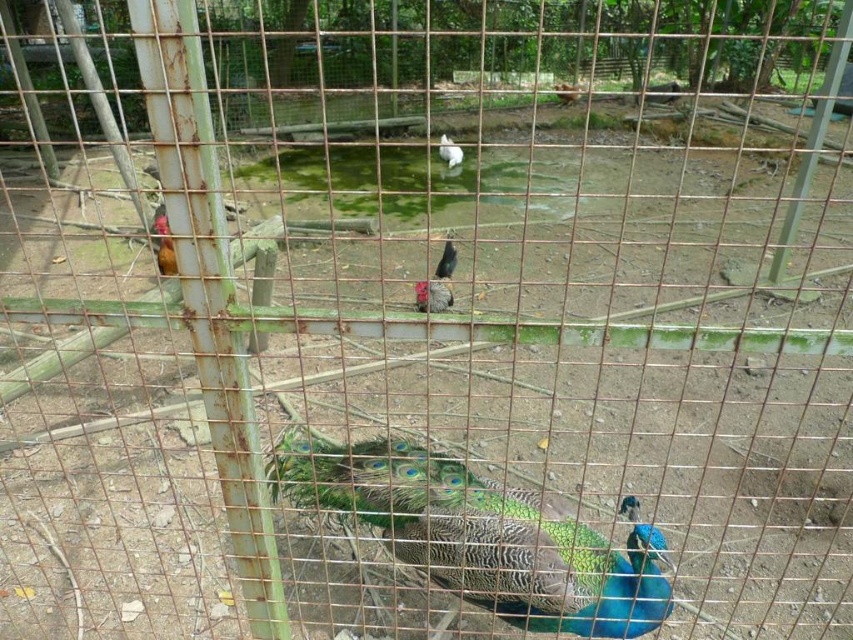
Does shiny blue peacock at center appear on the left side of shiny black rooster at center?

Indeed, shiny blue peacock at center is positioned on the left side of shiny black rooster at center.

Who is more forward, (535, 500) or (418, 296)?

Positioned in front is point (535, 500).

Locate an element on the screen. shiny blue peacock at center is located at coordinates (480, 536).

Does rusty metal rooster at left have a smaller size compared to white feathered chicken at center?

Actually, rusty metal rooster at left might be larger than white feathered chicken at center.

Who is more forward, (167, 275) or (450, 166)?

Point (167, 275) is more forward.

Identify the location of rusty metal rooster at left. The width and height of the screenshot is (853, 640). (x=163, y=243).

Does shiny blue peacock at center have a smaller size compared to white feathered chicken at center?

No.

Does shiny blue peacock at center appear over white feathered chicken at center?

No, shiny blue peacock at center is not above white feathered chicken at center.

At what (x,y) coordinates should I click in order to perform the action: click on shiny blue peacock at center. Please return your answer as a coordinate pair (x, y). Looking at the image, I should click on (480, 536).